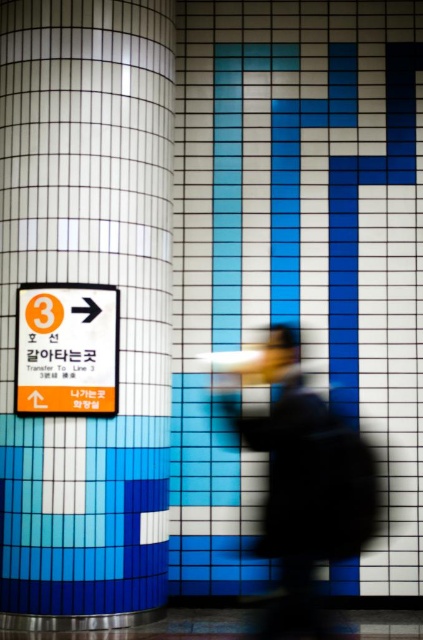
From the picture: Which is more to the left, white glossy pillar at left or orange plastic sign at left?

orange plastic sign at left

Is white glossy pillar at left above orange plastic sign at left?

Yes, white glossy pillar at left is above orange plastic sign at left.

Between point (52, 269) and point (96, 403), which one is positioned in front?

Point (96, 403) is more forward.

In order to click on white glossy pillar at left in this screenshot , I will do `click(88, 282)`.

Does white glossy pillar at left have a greater height compared to silhouette coat at center?

Yes.

Between point (125, 586) and point (368, 524), which one is positioned in front?

Positioned in front is point (368, 524).

Measure the distance between point (14, 609) and camera.

They are 7.98 meters apart.

Find the location of a particular element. white glossy pillar at left is located at coordinates (88, 282).

Which is more to the left, silhouette coat at center or orange plastic sign at left?

Positioned to the left is orange plastic sign at left.

Between silhouette coat at center and orange plastic sign at left, which one has more height?

Standing taller between the two is silhouette coat at center.

Is point (307, 451) farther from camera compared to point (84, 385)?

That is False.

The image size is (423, 640). In order to click on silhouette coat at center in this screenshot , I will do `click(304, 484)`.